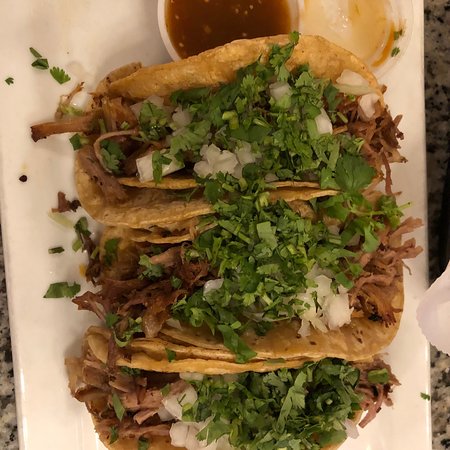
At what (x,y) coordinates should I click in order to perform the action: click on white rectangular platter. Please return your answer as a coordinate pair (x, y). The image size is (450, 450). Looking at the image, I should click on (17, 386), (406, 93).